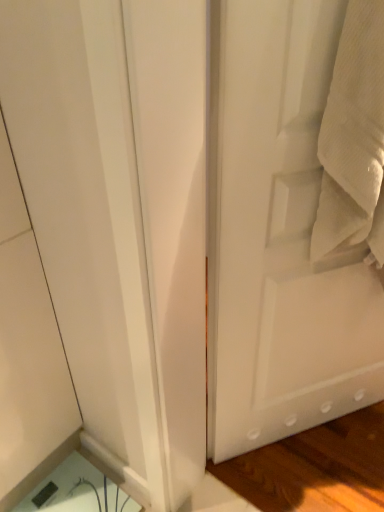
Question: Considering their positions, is white matte door at right located in front of or behind white textured towel at right?

Choices:
 (A) behind
 (B) front

Answer: (A)

Question: Considering the positions of white matte door at right and white textured towel at right in the image, is white matte door at right taller or shorter than white textured towel at right?

Choices:
 (A) short
 (B) tall

Answer: (B)

Question: Is point pos(243,53) closer or farther from the camera than point pos(347,159)?

Choices:
 (A) farther
 (B) closer

Answer: (B)

Question: From a real-world perspective, is white textured towel at right positioned above or below white matte door at right?

Choices:
 (A) above
 (B) below

Answer: (A)

Question: Is white textured towel at right taller or shorter than white matte door at right?

Choices:
 (A) tall
 (B) short

Answer: (B)

Question: Is white textured towel at right in front of or behind white matte door at right in the image?

Choices:
 (A) behind
 (B) front

Answer: (B)

Question: Would you say white textured towel at right is inside or outside white matte door at right?

Choices:
 (A) outside
 (B) inside

Answer: (A)